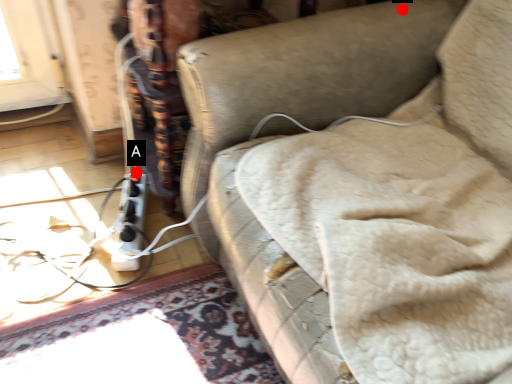
Question: Two points are circled on the image, labeled by A and B beside each circle. Which point appears farthest from the camera in this image?

Choices:
 (A) A is further
 (B) B is further

Answer: (A)